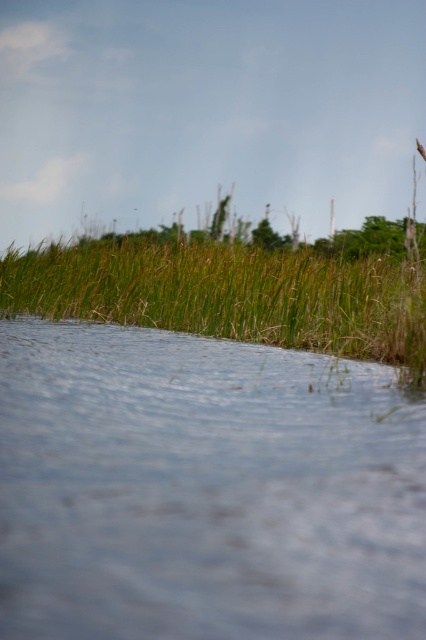
You are standing in the serene natural scene with the water in front of you. You notice two points marked in the image. Which point, point [224,621] or point [307,346], is closer to you?

Point [224,621] is closer to the viewer than point [307,346].

You are standing at the edge of the scene and want to cross to the other side. The clear water at lower center is in your path. Based on its position, can you step over it without getting your feet wet?

The clear water at lower center is located at point (204, 490), which means it is positioned near the middle of the lower part of the scene. Since it is in your direct path, you would need to step over or around it to avoid getting your feet wet.

You are standing at the edge of the scene and want to walk towards the clear water at lower center. There is green grass at upper center blocking your path. Can you walk around it? Explain your reasoning based on their positions.

The clear water at lower center is in front of the green grass at upper center, meaning the water is closer to you than the grass. Since the grass is behind the water, you can walk around it by moving to the sides of the clear water at lower center to reach your destination.